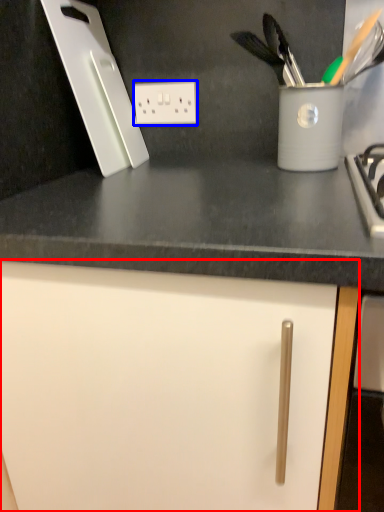
Question: Among these objects, which one is nearest to the camera, cabinetry (highlighted by a red box) or electric outlet (highlighted by a blue box)?

Choices:
 (A) cabinetry
 (B) electric outlet

Answer: (A)